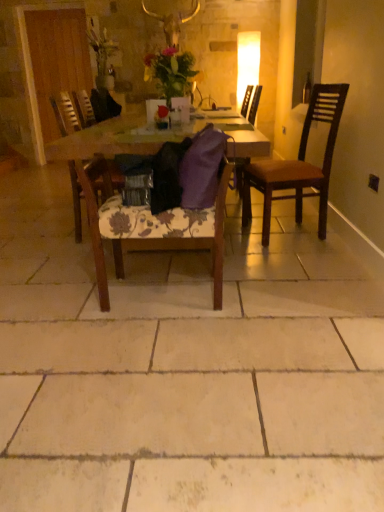
The image size is (384, 512). I want to click on vacant space situated on the left part of wooden chair at center, the first chair positioned from the left, so click(x=39, y=241).